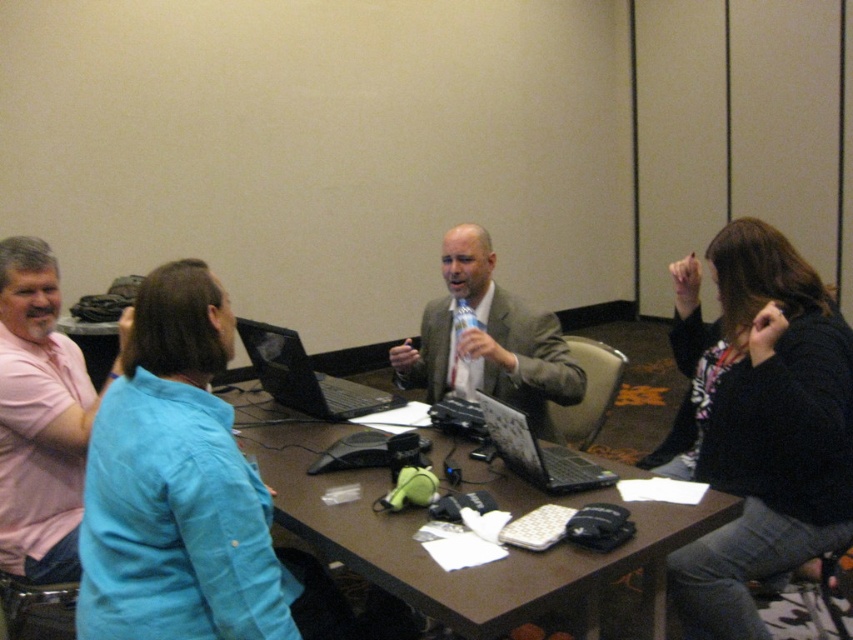
Does black sweater at right have a larger size compared to brown wooden table at center?

Actually, black sweater at right might be smaller than brown wooden table at center.

Image resolution: width=853 pixels, height=640 pixels. What are the coordinates of `black sweater at right` in the screenshot? It's located at (761, 422).

Which is in front, point (695, 381) or point (706, 515)?

Point (706, 515) is more forward.

You are a GUI agent. You are given a task and a screenshot of the screen. Output one action in this format:
    pyautogui.click(x=<x>, y=<y>)
    Task: Click on the black sweater at right
    
    Given the screenshot: What is the action you would take?
    click(x=761, y=422)

Which is behind, point (305, 356) or point (498, 444)?

The point (305, 356) is more distant.

How much distance is there between black matte laptop at center and silver metallic laptop at center?

black matte laptop at center is 27.84 inches from silver metallic laptop at center.

Which is behind, point (306, 385) or point (556, 467)?

Point (306, 385)

At what (x,y) coordinates should I click in order to perform the action: click on black matte laptop at center. Please return your answer as a coordinate pair (x, y). Looking at the image, I should click on (305, 376).

Is black sweater at right smaller than gray suit jacket at center?

Actually, black sweater at right might be larger than gray suit jacket at center.

Measure the distance between black sweater at right and camera.

The distance of black sweater at right from camera is 5.46 feet.

Does point (782, 504) lie behind point (474, 240)?

No, it is in front of (474, 240).

The width and height of the screenshot is (853, 640). Find the location of `black sweater at right`. black sweater at right is located at coordinates (761, 422).